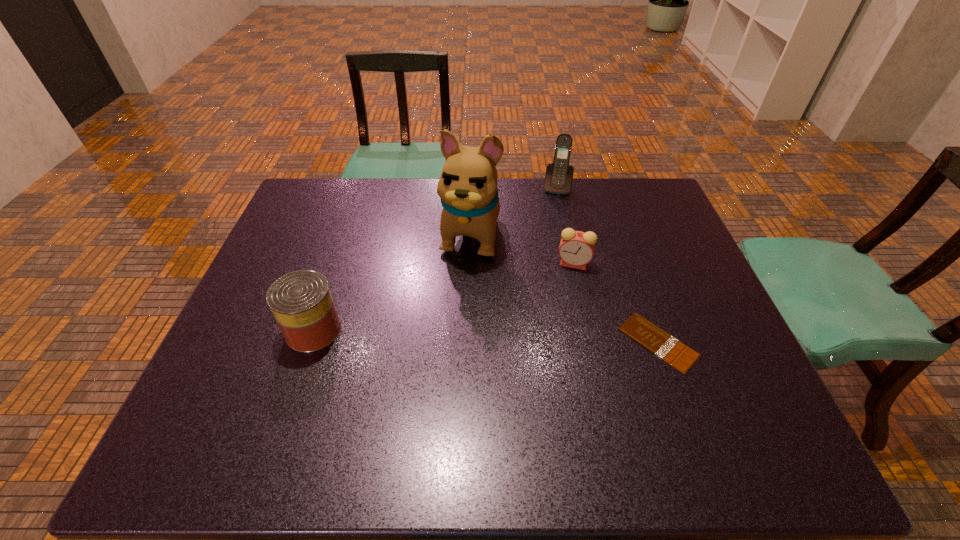
This screenshot has height=540, width=960. What are the coordinates of `vacant area that lies between the can and the alarm clock` in the screenshot? It's located at (444, 297).

Image resolution: width=960 pixels, height=540 pixels. Identify the location of vacant space that is in between the tallest object and the alarm clock. [x=522, y=248].

Identify the location of vacant area that lies between the third tallest object and the tallest object. (392, 281).

Identify the location of free point between the leftmost object and the cellular telephone. (435, 259).

Image resolution: width=960 pixels, height=540 pixels. I want to click on vacant area that lies between the second shortest object and the can, so click(444, 297).

The image size is (960, 540). Find the location of `free space that is in between the rightmost object and the can`. free space that is in between the rightmost object and the can is located at coordinates (486, 336).

Locate an element on the screen. This screenshot has height=540, width=960. free area in between the chocolate bar and the second object from left to right is located at coordinates (564, 287).

You are a GUI agent. You are given a task and a screenshot of the screen. Output one action in this format:
    pyautogui.click(x=<x>, y=<y>)
    Task: Click on the vacant space in between the can and the fourth shortest object
    The height and width of the screenshot is (540, 960).
    Given the screenshot: What is the action you would take?
    pyautogui.click(x=435, y=259)

You are a GUI agent. You are given a task and a screenshot of the screen. Output one action in this format:
    pyautogui.click(x=<x>, y=<y>)
    Task: Click on the empty space that is in between the chocolate bar and the farthest object
    The image size is (960, 540).
    Given the screenshot: What is the action you would take?
    pyautogui.click(x=607, y=265)

Identify which object is the second nearest to the fourth object from right to left. Please provide its 2D coordinates. Your answer should be formatted as a tuple, i.e. [(x, y)], where the tuple contains the x and y coordinates of a point satisfying the conditions above.

[(558, 179)]